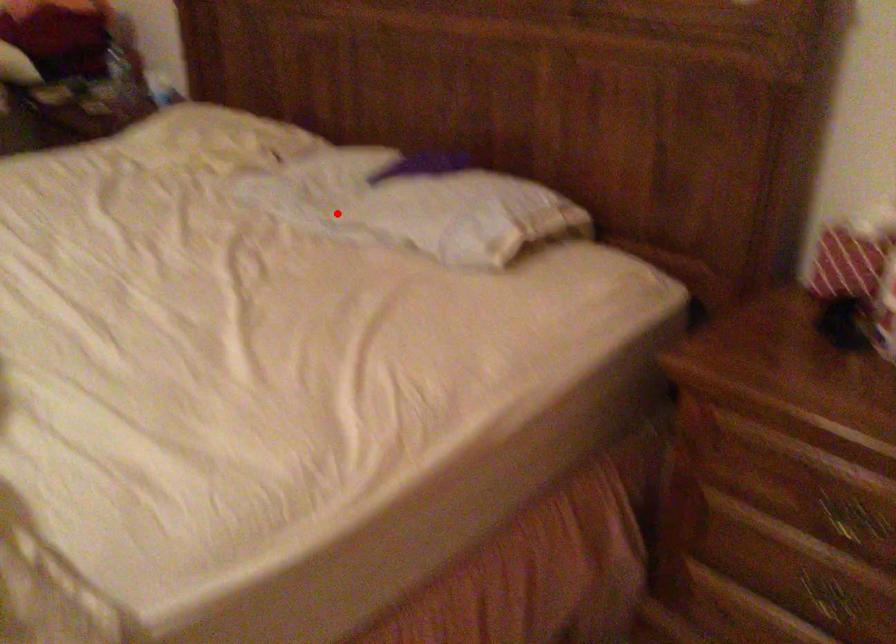
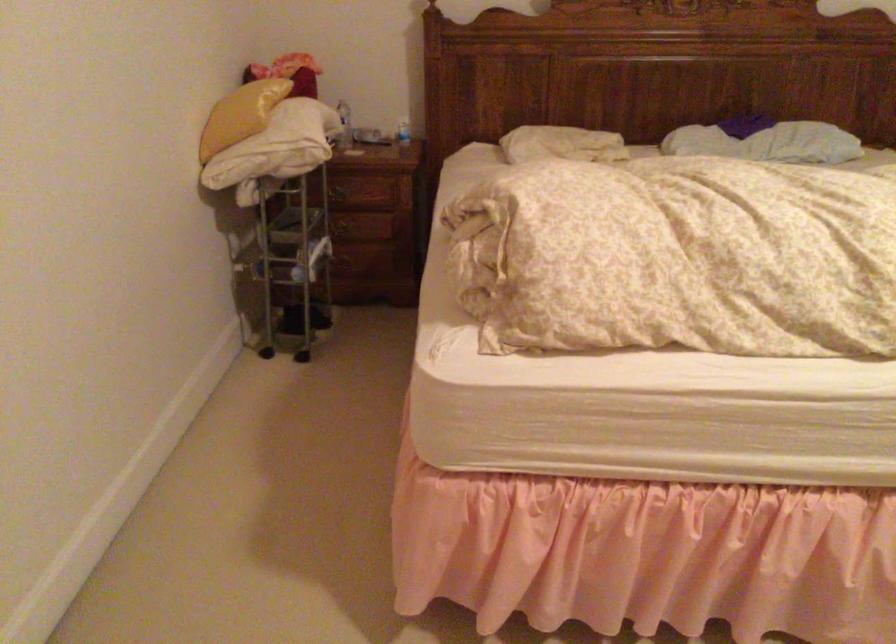
In the second image, find the point that corresponds to the highlighted location in the first image.

(767, 142)